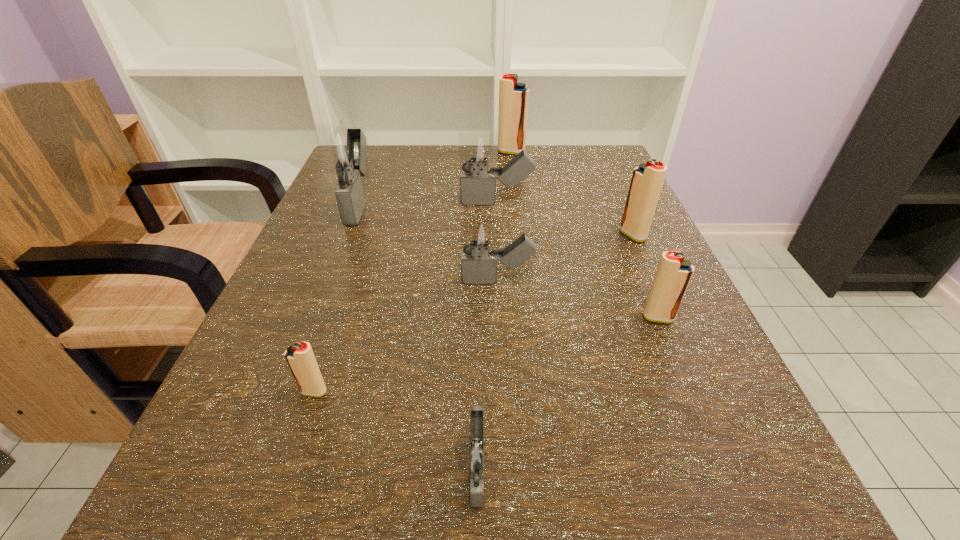
Identify the location of the farthest red igniter. (513, 96).

The height and width of the screenshot is (540, 960). Find the location of `the farthest object`. the farthest object is located at coordinates (513, 96).

Locate an element on the screen. the leftmost gray igniter is located at coordinates (342, 150).

Identify the location of the third smallest red igniter. (647, 180).

I want to click on the second biggest gray igniter, so click(x=478, y=152).

This screenshot has height=540, width=960. Identify the location of the third farthest gray igniter. (478, 266).

The image size is (960, 540). I want to click on the fifth farthest igniter, so click(x=478, y=266).

This screenshot has width=960, height=540. Identify the location of the sixth farthest igniter. (674, 272).

What are the coordinates of `the sixth farthest object` in the screenshot? It's located at (674, 272).

Locate an element on the screen. the second nearest igniter is located at coordinates (300, 357).